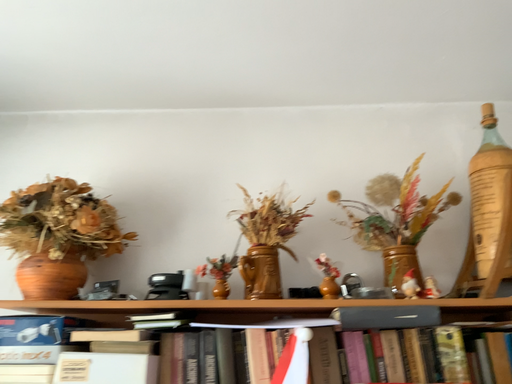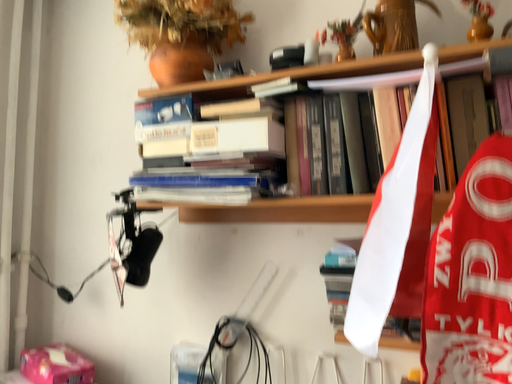
Question: How did the camera likely rotate when shooting the video?

Choices:
 (A) rotated downward
 (B) rotated upward

Answer: (A)